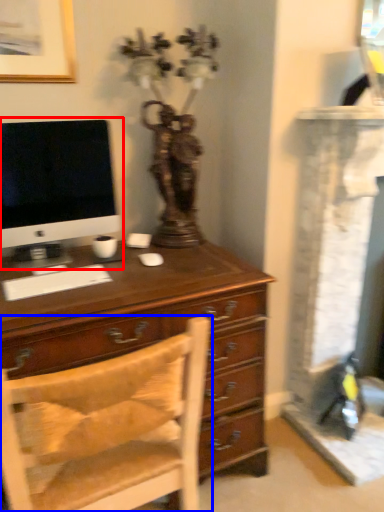
Question: Which of the following is the closest to the observer, computer monitor (highlighted by a red box) or chair (highlighted by a blue box)?

Choices:
 (A) computer monitor
 (B) chair

Answer: (B)